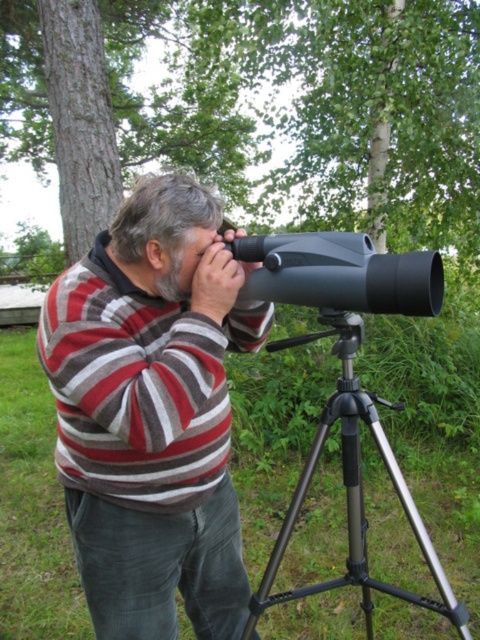
Question: Can you confirm if striped sweater at center is positioned below black metallic tripod at center?

Choices:
 (A) yes
 (B) no

Answer: (B)

Question: Among these points, which one is farthest from the camera?

Choices:
 (A) (431, 257)
 (B) (387, 449)
 (C) (137, 225)

Answer: (B)

Question: Estimate the real-world distances between objects in this image. Which object is farther from the striped sweater at center?

Choices:
 (A) black plastic telescope at center
 (B) black metallic tripod at center

Answer: (A)

Question: Can you confirm if black metallic tripod at center is bigger than black plastic telescope at center?

Choices:
 (A) no
 (B) yes

Answer: (B)

Question: Which object is the closest to the black plastic telescope at center?

Choices:
 (A) striped sweater at center
 (B) black metallic tripod at center

Answer: (A)

Question: From the image, what is the correct spatial relationship of striped sweater at center in relation to black plastic telescope at center?

Choices:
 (A) above
 (B) below

Answer: (B)